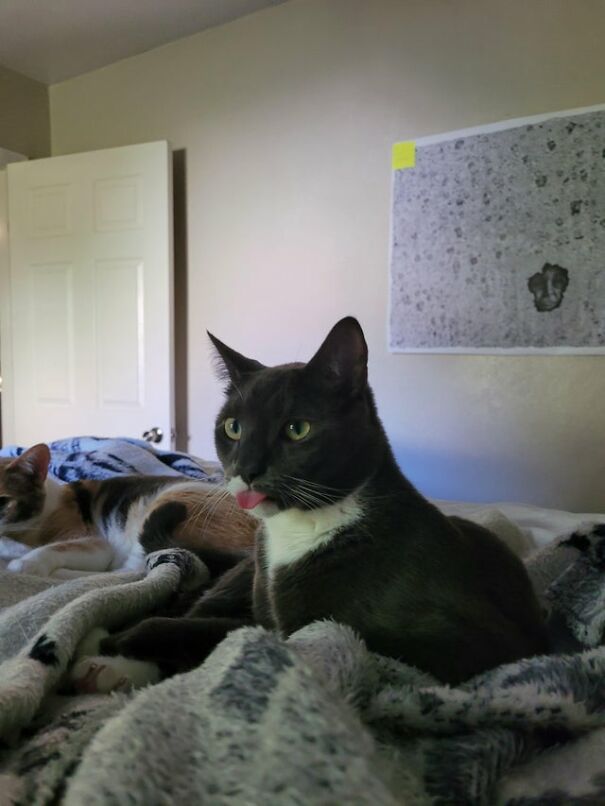
This screenshot has height=806, width=605. Find the location of `blanket`. blanket is located at coordinates (293, 694).